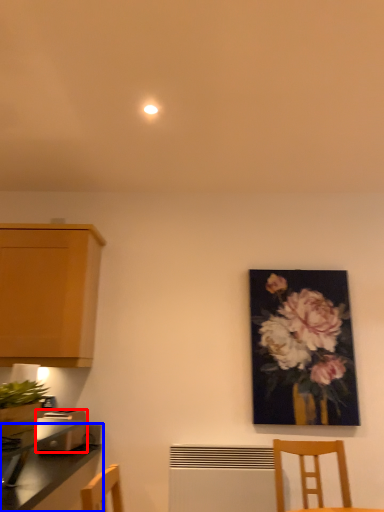
Question: Which of the following is the farthest to the observer, toaster (highlighted by a red box) or countertop (highlighted by a blue box)?

Choices:
 (A) toaster
 (B) countertop

Answer: (A)